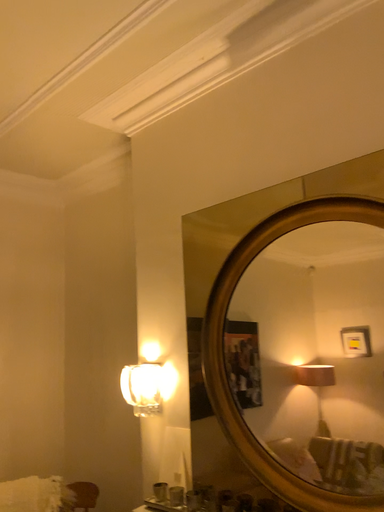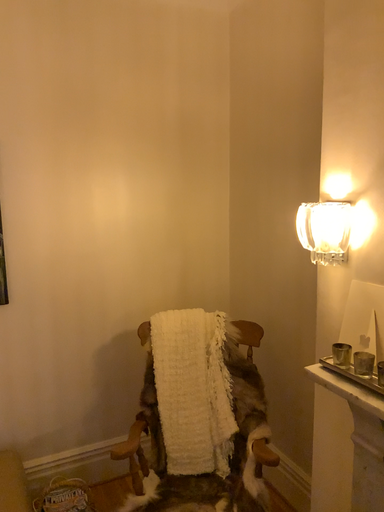
Question: How did the camera likely rotate when shooting the video?

Choices:
 (A) rotated downward
 (B) rotated upward

Answer: (A)